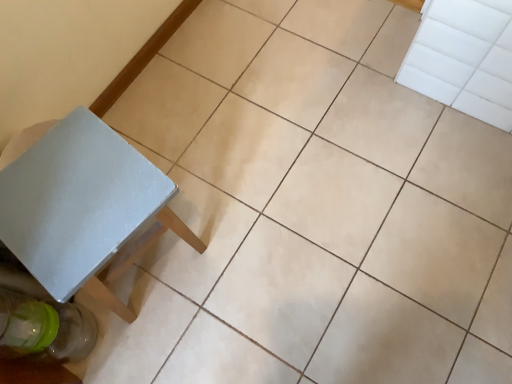
Where is `free space above white matte table at lower left (from a real-world perspective)`? free space above white matte table at lower left (from a real-world perspective) is located at coordinates (71, 189).